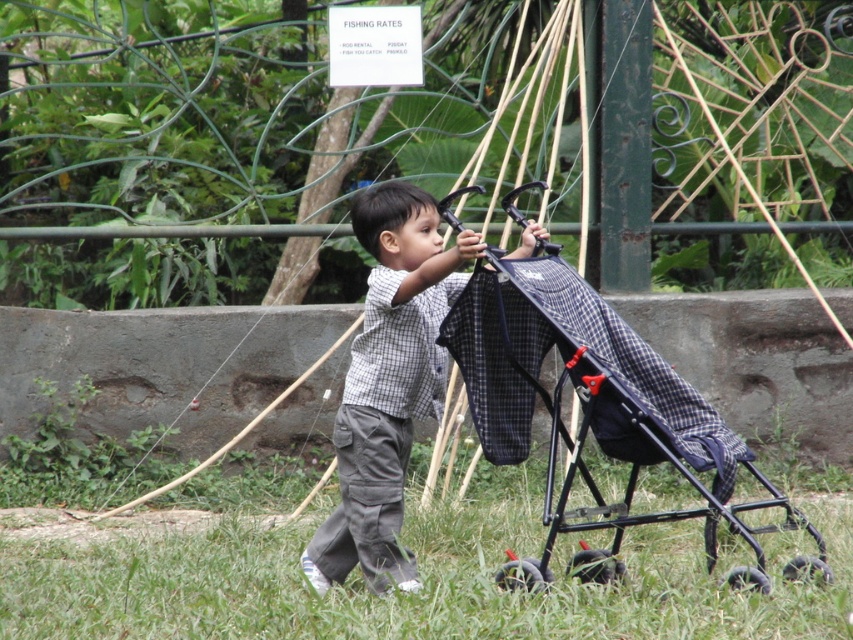
Question: Based on their relative distances, which object is farther from the plaid fabric stroller at center?

Choices:
 (A) gray checkered shirt at center
 (B) green grass at lower center

Answer: (B)

Question: Does green grass at lower center lie behind gray checkered shirt at center?

Choices:
 (A) no
 (B) yes

Answer: (A)

Question: Is green grass at lower center thinner than gray checkered shirt at center?

Choices:
 (A) no
 (B) yes

Answer: (A)

Question: Which point is farther to the camera?

Choices:
 (A) (352, 381)
 (B) (630, 387)

Answer: (A)

Question: Does green grass at lower center have a larger size compared to plaid fabric stroller at center?

Choices:
 (A) yes
 (B) no

Answer: (A)

Question: Estimate the real-world distances between objects in this image. Which object is closer to the green grass at lower center?

Choices:
 (A) gray checkered shirt at center
 (B) plaid fabric stroller at center

Answer: (B)